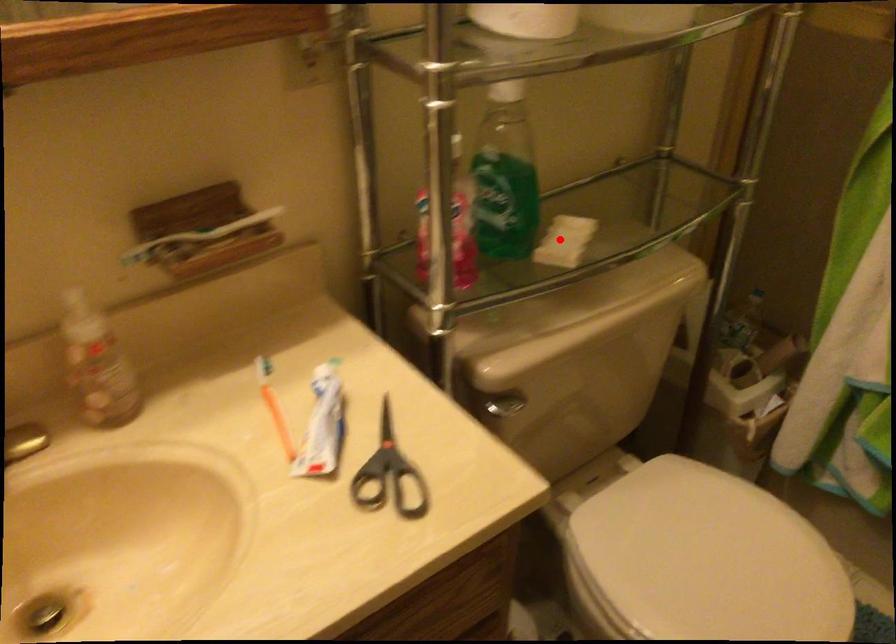
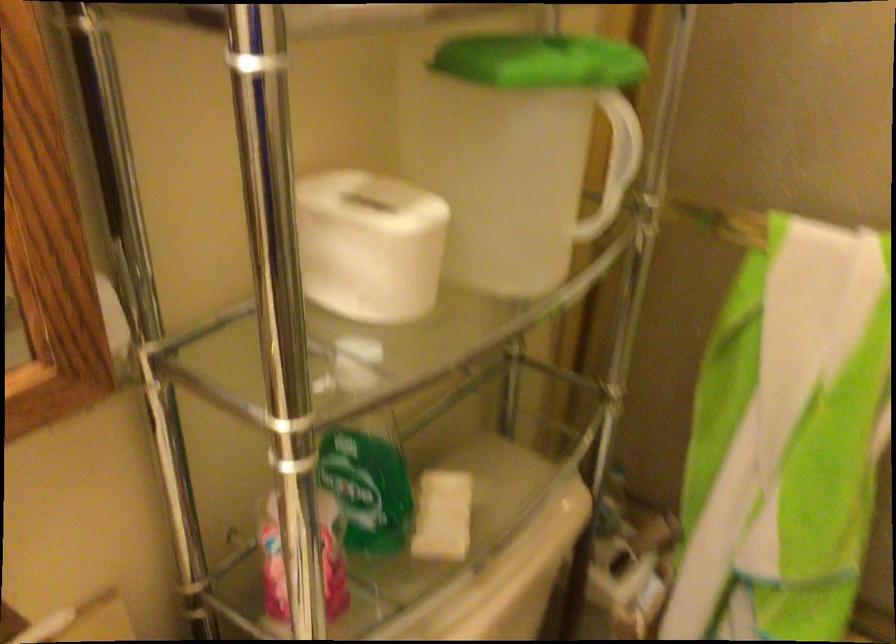
In the second image, find the point that corresponds to the highlighted location in the first image.

(442, 516)